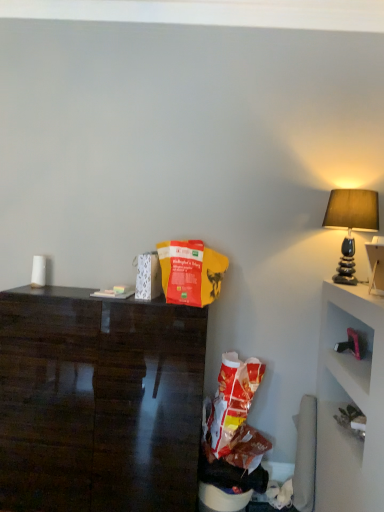
Question: In terms of width, does matte stone lamp at right look wider or thinner when compared to dark wood desk at left?

Choices:
 (A) wide
 (B) thin

Answer: (B)

Question: Is point (364, 206) positioned closer to the camera than point (140, 327)?

Choices:
 (A) farther
 (B) closer

Answer: (B)

Question: Considering the real-world distances, which object is farthest from the red matte paper bag at center?

Choices:
 (A) matte stone lamp at right
 (B) dark wood desk at left

Answer: (A)

Question: Considering the real-world distances, which object is farthest from the red matte paper bag at center?

Choices:
 (A) matte stone lamp at right
 (B) dark wood desk at left

Answer: (A)